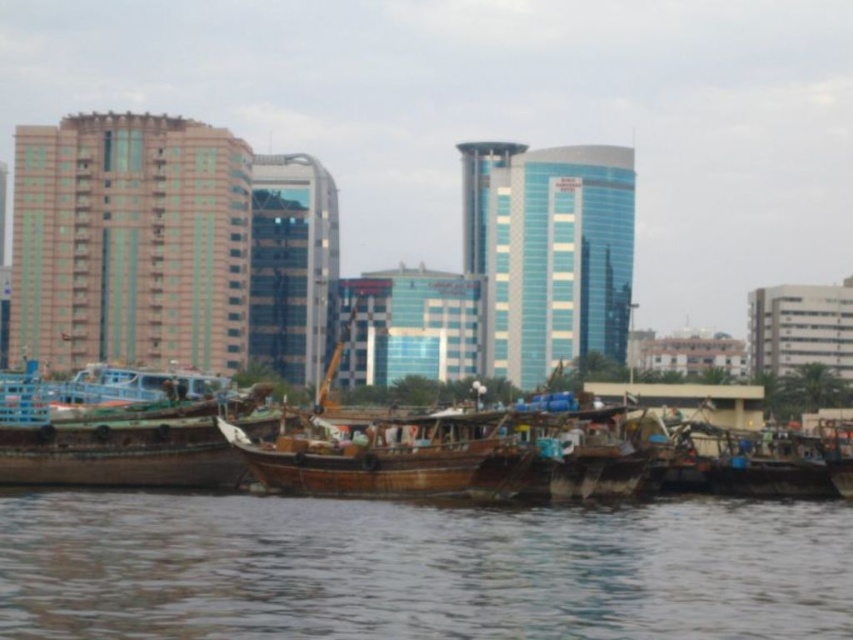
Does brown water at lower center appear over wooden boat at center?

Incorrect, brown water at lower center is not positioned above wooden boat at center.

Identify the location of brown water at lower center. (419, 568).

Measure the distance between brown water at lower center and camera.

They are 35.11 meters apart.

Is brown water at lower center wider than wooden boat at left?

Yes, brown water at lower center is wider than wooden boat at left.

Is point (473, 579) positioned behind point (161, 464)?

No.

Image resolution: width=853 pixels, height=640 pixels. In order to click on brown water at lower center in this screenshot , I will do `click(419, 568)`.

Who is shorter, wooden boat at left or wooden boat at center?

Standing shorter between the two is wooden boat at center.

Who is more distant from viewer, [161,428] or [410,481]?

The point [161,428] is behind.

The height and width of the screenshot is (640, 853). What do you see at coordinates (129, 445) in the screenshot?
I see `wooden boat at left` at bounding box center [129, 445].

Find the location of a particular element. This screenshot has width=853, height=640. wooden boat at left is located at coordinates (129, 445).